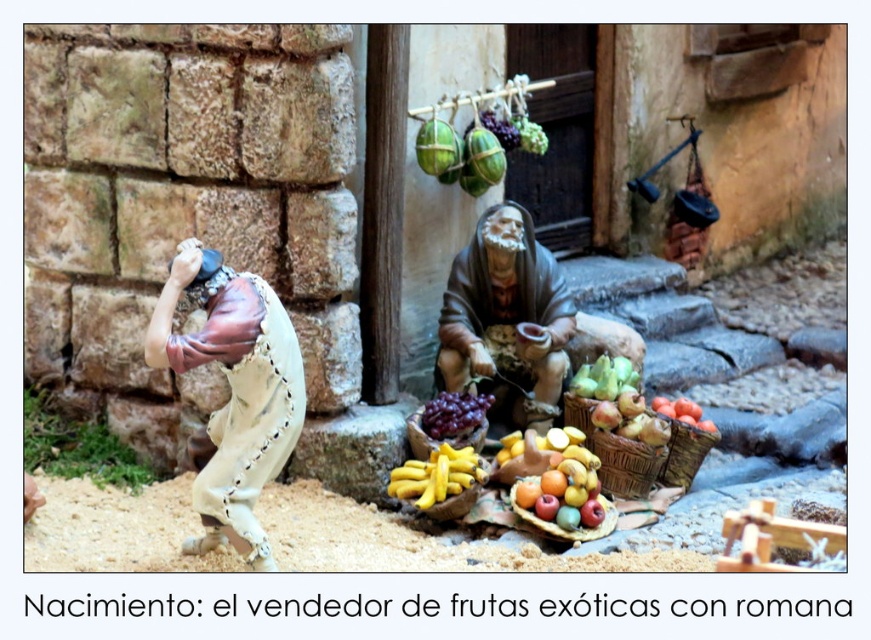
Between green matte melon at center and matte brown woven basket at center, which one has more height?

green matte melon at center

Which is behind, point (419, 141) or point (431, 442)?

Point (419, 141)

Which is behind, point (448, 125) or point (478, 445)?

Positioned behind is point (448, 125).

The height and width of the screenshot is (640, 871). In order to click on green matte melon at center in this screenshot , I will do `click(437, 148)`.

Can you confirm if matte brown robe at center is positioned above matte brown woven basket at center?

Correct, matte brown robe at center is located above matte brown woven basket at center.

This screenshot has width=871, height=640. What do you see at coordinates (517, 321) in the screenshot?
I see `matte brown robe at center` at bounding box center [517, 321].

From the picture: Who is more forward, (545,419) or (416,438)?

Point (416,438) is more forward.

You are a GUI agent. You are given a task and a screenshot of the screen. Output one action in this format:
    pyautogui.click(x=<x>, y=<y>)
    Task: Click on the matte brown robe at center
    The height and width of the screenshot is (640, 871).
    Given the screenshot: What is the action you would take?
    pyautogui.click(x=517, y=321)

Does point (152, 326) lie in front of point (456, 323)?

Yes, point (152, 326) is closer to viewer.

Is point (225, 509) closer to viewer compared to point (542, 355)?

Yes, it is.

Where is `matte brown leather at left`? The image size is (871, 640). matte brown leather at left is located at coordinates (235, 397).